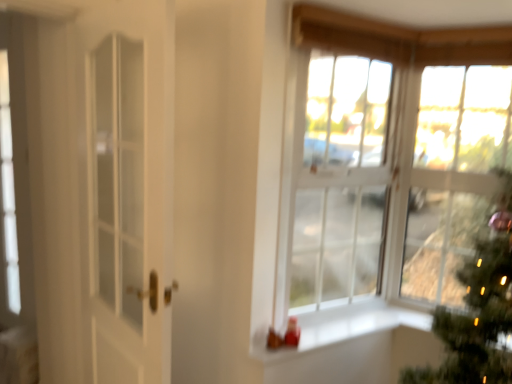
Find the location of a particular element. The width and height of the screenshot is (512, 384). clear glass window at upper right, which appears as the first window when viewed from the front is located at coordinates (357, 150).

At what (x,y) coordinates should I click in order to perform the action: click on white glass window at center, which appears as the 2th window when viewed from the back. Please return your answer as a coordinate pair (x, y). Image resolution: width=512 pixels, height=384 pixels. Looking at the image, I should click on (337, 176).

I want to click on white smooth window sill at center, so (344, 327).

Describe the element at coordinates (344, 327) in the screenshot. I see `white smooth window sill at center` at that location.

This screenshot has height=384, width=512. Find the location of `clear glass window at upper right, the first window from the back`. clear glass window at upper right, the first window from the back is located at coordinates (453, 174).

Considering the relative sizes of white smooth window sill at center and clear glass window at upper right, which is the 3th window from back to front, in the image provided, is white smooth window sill at center taller than clear glass window at upper right, which is the 3th window from back to front,?

In fact, white smooth window sill at center may be shorter than clear glass window at upper right, which is the 3th window from back to front.

Considering the relative sizes of white smooth window sill at center and clear glass window at upper right, which appears as the first window when viewed from the front, in the image provided, is white smooth window sill at center wider than clear glass window at upper right, which appears as the first window when viewed from the front,?

No.

From a real-world perspective, which object rests below the other?

white smooth window sill at center, from a real-world perspective.

Which of these two, white smooth window sill at center or white glass window at center, the 2th window when ordered from front to back, is wider?

→ Wider between the two is white smooth window sill at center.

Who is smaller, white smooth window sill at center or white glass window at center, the 2th window when ordered from front to back?

Smaller between the two is white smooth window sill at center.

Looking at this image, from the image's perspective, is white smooth window sill at center located above or below white glass window at center, the 2th window when ordered from front to back?

From the image's perspective, white smooth window sill at center appears below white glass window at center, the 2th window when ordered from front to back.

Measure the distance from white smooth window sill at center to white glass window at center, the 2th window when ordered from front to back.

white smooth window sill at center and white glass window at center, the 2th window when ordered from front to back, are 20.26 inches apart from each other.

Measure the distance between white smooth window sill at center and white glossy door at left.

white smooth window sill at center is 38.20 inches from white glossy door at left.

Would you say white glossy door at left is part of white smooth window sill at center's contents?

No, white glossy door at left is not surrounded by white smooth window sill at center.

From a real-world perspective, is white smooth window sill at center positioned over white glossy door at left based on gravity?

No, from a real-world perspective, white smooth window sill at center is not above white glossy door at left.

Is white smooth window sill at center positioned far away from white glossy door at left?

white smooth window sill at center is actually quite close to white glossy door at left.

Find the location of a particular element. the 2nd window behind when counting from the white glossy door at left is located at coordinates (453, 174).

Could you tell me if clear glass window at upper right, the first window from the back, is facing white glossy door at left?

No.

Considering the sizes of objects clear glass window at upper right, arranged as the 3th window when viewed from the front, and white glossy door at left in the image provided, who is wider, clear glass window at upper right, arranged as the 3th window when viewed from the front, or white glossy door at left?

clear glass window at upper right, arranged as the 3th window when viewed from the front, is wider.

In the scene shown: From a real-world perspective, is clear glass window at upper right, arranged as the 3th window when viewed from the front, physically located above or below white glossy door at left?

From a real-world perspective, clear glass window at upper right, arranged as the 3th window when viewed from the front, is physically above white glossy door at left.

From a real-world perspective, does white glossy door at left sit lower than white smooth window sill at center?

No, from a real-world perspective, white glossy door at left is not below white smooth window sill at center.

Between white glossy door at left and white smooth window sill at center, which one has less height?

white smooth window sill at center.

How far apart are white glossy door at left and white smooth window sill at center?

white glossy door at left is 38.20 inches from white smooth window sill at center.

What's the angular difference between white glossy door at left and white smooth window sill at center's facing directions?

The facing directions of white glossy door at left and white smooth window sill at center are 79.7 degrees apart.

From the image's perspective, which is above, clear glass window at upper right, the first window from the back, or white glass window at center, the 2th window when ordered from front to back?

white glass window at center, the 2th window when ordered from front to back, is shown above in the image.

Considering the positions of points (457, 232) and (336, 252), is point (457, 232) closer to camera compared to point (336, 252)?

Yes, it is.

Which of these two, clear glass window at upper right, the first window from the back, or white glass window at center, the 2th window when ordered from front to back, stands shorter?

clear glass window at upper right, the first window from the back.

Does clear glass window at upper right, which is the 3th window from back to front, have a smaller size compared to clear glass window at upper right, arranged as the 3th window when viewed from the front?

Incorrect, clear glass window at upper right, which is the 3th window from back to front, is not smaller in size than clear glass window at upper right, arranged as the 3th window when viewed from the front.

Is clear glass window at upper right, which appears as the first window when viewed from the front, looking in the opposite direction of clear glass window at upper right, arranged as the 3th window when viewed from the front?

Yes.

Would you say clear glass window at upper right, which is the 3th window from back to front, is inside or outside clear glass window at upper right, arranged as the 3th window when viewed from the front?

clear glass window at upper right, which is the 3th window from back to front, exists outside the volume of clear glass window at upper right, arranged as the 3th window when viewed from the front.

Is clear glass window at upper right, which is the 3th window from back to front, directly adjacent to clear glass window at upper right, arranged as the 3th window when viewed from the front?

No, clear glass window at upper right, which is the 3th window from back to front, is not beside clear glass window at upper right, arranged as the 3th window when viewed from the front.

Identify the location of window sill that appears on the left of clear glass window at upper right, which is the 3th window from back to front. This screenshot has width=512, height=384. (344, 327).

Find the location of a particular element. The height and width of the screenshot is (384, 512). window that is the 1st object to the right of the white smooth window sill at center, starting at the anchor is located at coordinates (337, 176).

Which object lies nearer to the anchor point white smooth window sill at center, white glass window at center, which appears as the 2th window when viewed from the back, or clear glass window at upper right, the first window from the back?

white glass window at center, which appears as the 2th window when viewed from the back, is closer to white smooth window sill at center.

Considering their positions, is white smooth window sill at center positioned closer to clear glass window at upper right, which appears as the first window when viewed from the front, than clear glass window at upper right, the first window from the back?

clear glass window at upper right, the first window from the back, lies closer to clear glass window at upper right, which appears as the first window when viewed from the front, than the other object.

Looking at the image, which one is located closer to clear glass window at upper right, which is the 3th window from back to front, white glossy door at left or white glass window at center, the 2th window when ordered from front to back?

Among the two, white glass window at center, the 2th window when ordered from front to back, is located nearer to clear glass window at upper right, which is the 3th window from back to front.

Which object lies nearer to the anchor point clear glass window at upper right, which appears as the first window when viewed from the front, white glass window at center, the 2th window when ordered from front to back, or white glossy door at left?

white glass window at center, the 2th window when ordered from front to back.

Considering their positions, is white glossy door at left positioned further to white smooth window sill at center than clear glass window at upper right, which is the 3th window from back to front?

white glossy door at left lies further to white smooth window sill at center than the other object.

Based on their spatial positions, is clear glass window at upper right, which is the 3th window from back to front, or white smooth window sill at center further from clear glass window at upper right, the first window from the back?

white smooth window sill at center lies further to clear glass window at upper right, the first window from the back, than the other object.

Consider the image. Looking at the image, which one is located further to white glossy door at left, white glass window at center, which appears as the 2th window when viewed from the back, or clear glass window at upper right, which is the 3th window from back to front?

The object further to white glossy door at left is clear glass window at upper right, which is the 3th window from back to front.

In the scene shown: Considering their positions, is clear glass window at upper right, which appears as the first window when viewed from the front, positioned closer to white glass window at center, which appears as the 2th window when viewed from the back, than white glossy door at left?

clear glass window at upper right, which appears as the first window when viewed from the front.

At what (x,y) coordinates should I click in order to perform the action: click on window between clear glass window at upper right, which appears as the first window when viewed from the front, and clear glass window at upper right, arranged as the 3th window when viewed from the front, from front to back. Please return your answer as a coordinate pair (x, y). Looking at the image, I should click on (337, 176).

Where is `window situated between white glossy door at left and clear glass window at upper right, which is the 3th window from back to front, from left to right`? The height and width of the screenshot is (384, 512). window situated between white glossy door at left and clear glass window at upper right, which is the 3th window from back to front, from left to right is located at coordinates (337, 176).

Find the location of `window sill between clear glass window at upper right, which appears as the first window when viewed from the front, and clear glass window at upper right, the first window from the back, along the z-axis`. window sill between clear glass window at upper right, which appears as the first window when viewed from the front, and clear glass window at upper right, the first window from the back, along the z-axis is located at coordinates (344, 327).

At what (x,y) coordinates should I click in order to perform the action: click on window sill between clear glass window at upper right, which appears as the first window when viewed from the front, and white glass window at center, which appears as the 2th window when viewed from the back, from front to back. Please return your answer as a coordinate pair (x, y). Looking at the image, I should click on (344, 327).